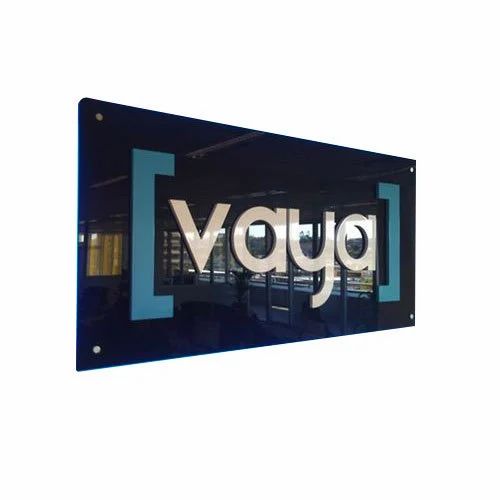
The height and width of the screenshot is (500, 500). I want to click on curtains, so click(103, 250).